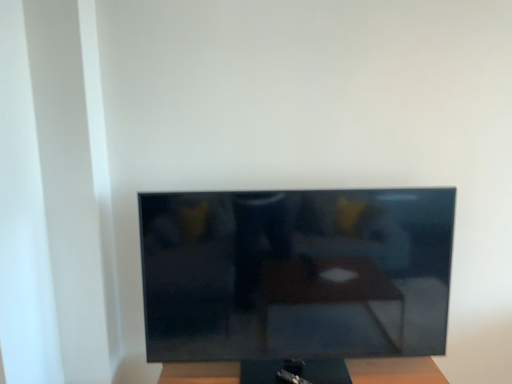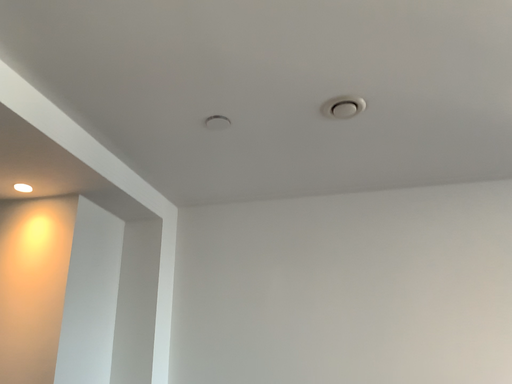
Question: How did the camera likely rotate when shooting the video?

Choices:
 (A) rotated right
 (B) rotated left

Answer: (B)